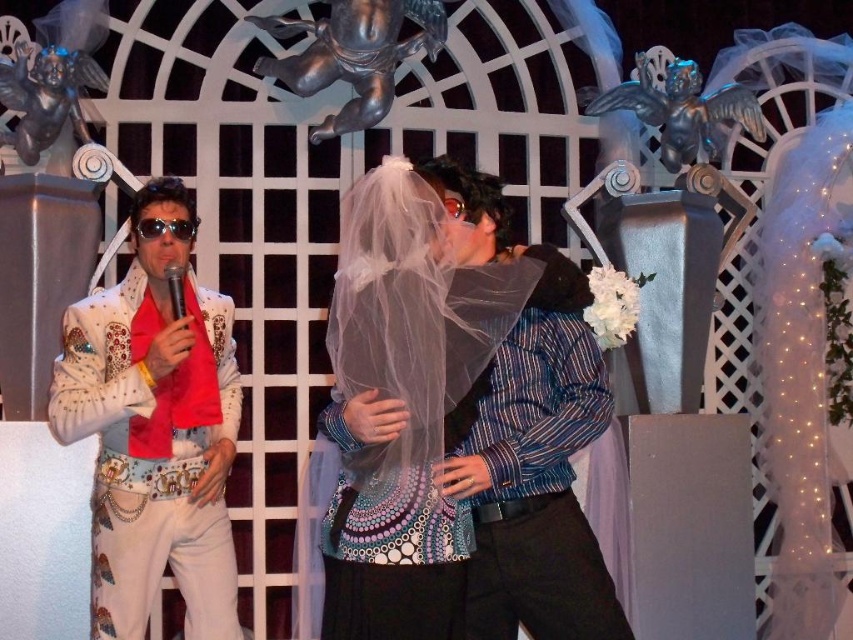
You are a photographer at this event and need to capture a photo where both the matte white veil at center and the white sequined jacket at left are clearly visible. Considering their sizes, which object should you focus on first to ensure both are in frame?

The matte white veil at center is much taller than the white sequined jacket at left, so focusing on the taller veil first will help ensure both are in frame as the jacket is smaller and lower.

You are a photographer positioned at the center of the scene. You want to take a photo that includes both the matte white veil at center and the white sequined jacket at left. Given that your camera has a maximum focus range of 5 meters, will you be able to capture both objects clearly in the same frame?

The matte white veil at center is 5.69 meters away from the white sequined jacket at left. Since the distance between them exceeds the camera maximum focus range of 5 meters, you won not be able to capture both objects clearly in the same frame.